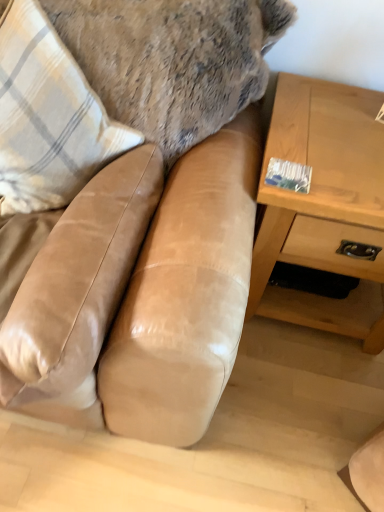
Question: In terms of width, does light brown wood table at right look wider or thinner when compared to tan leather couch at center?

Choices:
 (A) thin
 (B) wide

Answer: (A)

Question: Is light brown wood table at right taller or shorter than tan leather couch at center?

Choices:
 (A) tall
 (B) short

Answer: (B)

Question: Which is farther from the tan leather couch at center?

Choices:
 (A) plaid fabric pillow at left
 (B) light brown wood table at right
 (C) suede tan swivel chair at center

Answer: (B)

Question: Which of these objects is positioned farthest from the light brown wood table at right?

Choices:
 (A) tan leather couch at center
 (B) plaid fabric pillow at left
 (C) suede tan swivel chair at center

Answer: (B)